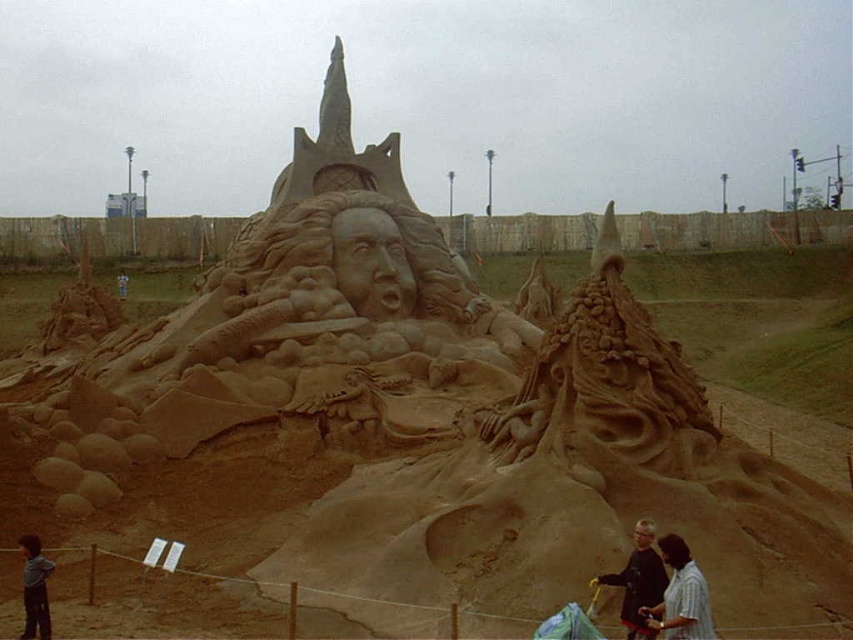
Question: Among these objects, which one is farthest from the camera?

Choices:
 (A) blue fabric at center
 (B) striped shirt at lower right

Answer: (A)

Question: Which point is farther to the camera?

Choices:
 (A) dark gray shirt at lower right
 (B) blue fabric at center

Answer: (B)

Question: Is dark gray shirt at lower right positioned before dark brown hair at lower left?

Choices:
 (A) yes
 (B) no

Answer: (A)

Question: Which point appears farthest from the camera in this image?

Choices:
 (A) (677, 582)
 (B) (120, 282)
 (C) (51, 568)
 (D) (637, 595)

Answer: (B)

Question: Observing the image, what is the correct spatial positioning of striped shirt at lower right in reference to dark gray shirt at lower right?

Choices:
 (A) right
 (B) left

Answer: (A)

Question: Does dark brown hair at lower left have a greater width compared to blue fabric at center?

Choices:
 (A) yes
 (B) no

Answer: (B)